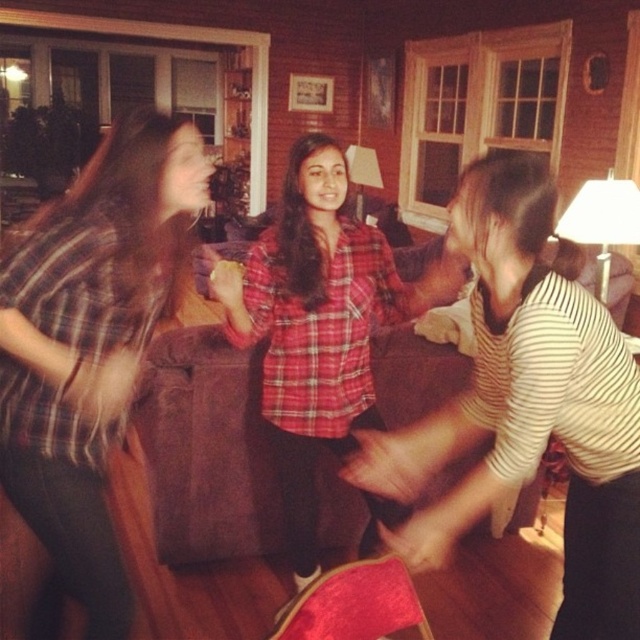
Is striped cotton shirt at center in front of plaid shirt at center?

Yes, striped cotton shirt at center is in front of plaid shirt at center.

Which is behind, point (502, 378) or point (150, 214)?

Point (150, 214)

Locate an element on the screen. The image size is (640, 640). striped cotton shirt at center is located at coordinates (528, 406).

Is plaid shirt at center shorter than red plaid shirt at center?

Yes.

Which is in front, point (74, 516) or point (266, 364)?

Point (74, 516) is more forward.

Identify the location of plaid shirt at center. This screenshot has height=640, width=640. (90, 340).

Who is positioned more to the left, striped cotton shirt at center or red plaid shirt at center?

From the viewer's perspective, red plaid shirt at center appears more on the left side.

Between striped cotton shirt at center and red plaid shirt at center, which one has less height?

Standing shorter between the two is striped cotton shirt at center.

Does point (513, 234) come behind point (348, 236)?

That is False.

Identify the location of striped cotton shirt at center. The width and height of the screenshot is (640, 640). click(528, 406).